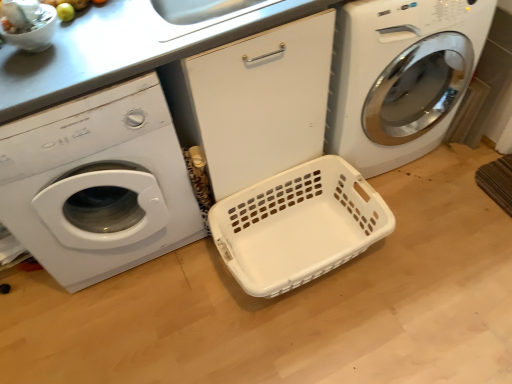
I want to click on white plastic basket at center, so click(x=298, y=225).

The width and height of the screenshot is (512, 384). What are the coordinates of `white plastic basket at center` in the screenshot? It's located at (298, 225).

From a real-world perspective, does white plastic basket at center sit lower than white plastic washing machine at left, which is the 1th washing machine from left to right?

Correct, in the physical world, white plastic basket at center is lower than white plastic washing machine at left, which is the 1th washing machine from left to right.

Looking at the image, does white plastic basket at center seem bigger or smaller compared to white plastic washing machine at left, which is the 1th washing machine from left to right?

Clearly, white plastic basket at center is smaller in size than white plastic washing machine at left, which is the 1th washing machine from left to right.

Is white plastic basket at center facing away from white plastic washing machine at left, the second washing machine from the right?

No, white plastic basket at center's orientation is not away from white plastic washing machine at left, the second washing machine from the right.

Is white glossy washing machine at center, marked as the 1th washing machine in a right-to-left arrangement, wider than white plastic basket at center?

Yes.

Does point (382, 152) come behind point (321, 264)?

Yes, point (382, 152) is farther from viewer.

Does white glossy washing machine at center, marked as the 1th washing machine in a right-to-left arrangement, have a smaller size compared to white plastic basket at center?

Incorrect, white glossy washing machine at center, marked as the 1th washing machine in a right-to-left arrangement, is not smaller in size than white plastic basket at center.

From a real-world perspective, is white glossy washing machine at center, marked as the 1th washing machine in a right-to-left arrangement, positioned over white plastic basket at center based on gravity?

Yes, from a real-world perspective, white glossy washing machine at center, marked as the 1th washing machine in a right-to-left arrangement, is on top of white plastic basket at center.

Is white plastic basket at center smaller than white glossy washing machine at center, the 2th washing machine viewed from the left?

Yes, white plastic basket at center is smaller than white glossy washing machine at center, the 2th washing machine viewed from the left.

In order to click on the 2nd washing machine positioned above the white plastic basket at center (from the image's perspective) in this screenshot , I will do `click(400, 77)`.

Between white plastic basket at center and white glossy washing machine at center, the 2th washing machine viewed from the left, which one has less height?

With less height is white plastic basket at center.

Is white plastic basket at center inside or outside of white glossy washing machine at center, the 2th washing machine viewed from the left?

white plastic basket at center is located beyond the bounds of white glossy washing machine at center, the 2th washing machine viewed from the left.

Can white glossy washing machine at center, marked as the 1th washing machine in a right-to-left arrangement, be found inside white plastic washing machine at left, the second washing machine from the right?

Definitely not — white glossy washing machine at center, marked as the 1th washing machine in a right-to-left arrangement, is not inside white plastic washing machine at left, the second washing machine from the right.

Looking at this image, from their relative heights in the image, would you say white plastic washing machine at left, the second washing machine from the right, is taller or shorter than white glossy washing machine at center, marked as the 1th washing machine in a right-to-left arrangement?

Considering their sizes, white plastic washing machine at left, the second washing machine from the right, has more height than white glossy washing machine at center, marked as the 1th washing machine in a right-to-left arrangement.

From the image's perspective, is white plastic washing machine at left, which is the 1th washing machine from left to right, positioned above or below white glossy washing machine at center, marked as the 1th washing machine in a right-to-left arrangement?

Clearly, from the image's perspective, white plastic washing machine at left, which is the 1th washing machine from left to right, is below white glossy washing machine at center, marked as the 1th washing machine in a right-to-left arrangement.

The width and height of the screenshot is (512, 384). Identify the location of washing machine above the white glossy washing machine at center, the 2th washing machine viewed from the left (from a real-world perspective). (98, 184).

Is white plastic washing machine at left, which is the 1th washing machine from left to right, outside of white plastic basket at center?

white plastic washing machine at left, which is the 1th washing machine from left to right, lies outside white plastic basket at center's area.

Is white plastic washing machine at left, the second washing machine from the right, looking in the opposite direction of white plastic basket at center?

No, white plastic washing machine at left, the second washing machine from the right, is not facing away from white plastic basket at center.

Are white plastic washing machine at left, which is the 1th washing machine from left to right, and white plastic basket at center far apart?

No, white plastic washing machine at left, which is the 1th washing machine from left to right, is in close proximity to white plastic basket at center.

From the image's perspective, is white plastic washing machine at left, which is the 1th washing machine from left to right, on white plastic basket at center?

Yes, from the image's perspective, white plastic washing machine at left, which is the 1th washing machine from left to right, is over white plastic basket at center.

Which point is more forward, (x=488, y=19) or (x=13, y=129)?

The point (x=13, y=129) is closer.

In the image, is white glossy washing machine at center, the 2th washing machine viewed from the left, on the left side or the right side of white plastic washing machine at left, the second washing machine from the right?

Based on their positions, white glossy washing machine at center, the 2th washing machine viewed from the left, is located to the right of white plastic washing machine at left, the second washing machine from the right.

From the picture: Is white plastic washing machine at left, which is the 1th washing machine from left to right, at the back of white glossy washing machine at center, the 2th washing machine viewed from the left?

white glossy washing machine at center, the 2th washing machine viewed from the left, is not turned away from white plastic washing machine at left, which is the 1th washing machine from left to right.

Find the location of a particular element. Image resolution: width=512 pixels, height=384 pixels. washing machine above the white glossy washing machine at center, marked as the 1th washing machine in a right-to-left arrangement (from a real-world perspective) is located at coordinates (98, 184).

In order to click on washing machine that is the 1st one when counting upward from the white plastic basket at center (from the image's perspective) in this screenshot , I will do `click(98, 184)`.

Identify the location of basket container below the white glossy washing machine at center, marked as the 1th washing machine in a right-to-left arrangement (from a real-world perspective). tap(298, 225).

Which object lies further to the anchor point white plastic basket at center, white glossy washing machine at center, marked as the 1th washing machine in a right-to-left arrangement, or white plastic washing machine at left, which is the 1th washing machine from left to right?

Based on the image, white plastic washing machine at left, which is the 1th washing machine from left to right, appears to be further to white plastic basket at center.

Considering their positions, is white glossy washing machine at center, marked as the 1th washing machine in a right-to-left arrangement, positioned further to white plastic washing machine at left, the second washing machine from the right, than white plastic basket at center?

Among the two, white glossy washing machine at center, marked as the 1th washing machine in a right-to-left arrangement, is located further to white plastic washing machine at left, the second washing machine from the right.

From the image, which object appears to be nearer to white plastic washing machine at left, the second washing machine from the right, white plastic basket at center or white glossy washing machine at center, the 2th washing machine viewed from the left?

Based on the image, white plastic basket at center appears to be nearer to white plastic washing machine at left, the second washing machine from the right.

From the image, which object appears to be farther from white plastic basket at center, white plastic washing machine at left, which is the 1th washing machine from left to right, or white glossy washing machine at center, the 2th washing machine viewed from the left?

white plastic washing machine at left, which is the 1th washing machine from left to right, lies further to white plastic basket at center than the other object.

Considering their positions, is white plastic basket at center positioned closer to white glossy washing machine at center, the 2th washing machine viewed from the left, than white plastic washing machine at left, which is the 1th washing machine from left to right?

white plastic basket at center is positioned closer to the anchor white glossy washing machine at center, the 2th washing machine viewed from the left.

Looking at the image, which one is located further to white glossy washing machine at center, marked as the 1th washing machine in a right-to-left arrangement, white plastic washing machine at left, the second washing machine from the right, or white plastic basket at center?

Based on the image, white plastic washing machine at left, the second washing machine from the right, appears to be further to white glossy washing machine at center, marked as the 1th washing machine in a right-to-left arrangement.

Find the location of a particular element. The image size is (512, 384). basket container between white plastic washing machine at left, which is the 1th washing machine from left to right, and white glossy washing machine at center, the 2th washing machine viewed from the left is located at coordinates (298, 225).